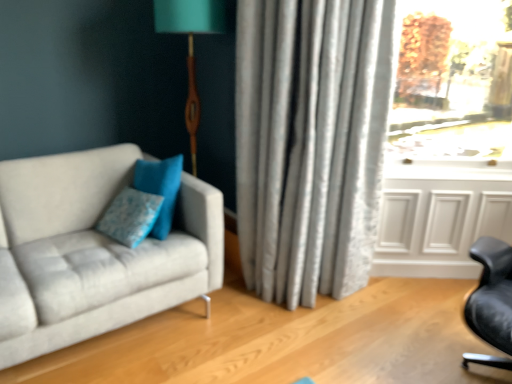
Question: Considering the relative sizes of transparent glass window at upper right and blue fabric pillow at center in the image provided, is transparent glass window at upper right thinner than blue fabric pillow at center?

Choices:
 (A) no
 (B) yes

Answer: (A)

Question: Does transparent glass window at upper right have a smaller size compared to blue fabric pillow at center?

Choices:
 (A) yes
 (B) no

Answer: (B)

Question: Would you say transparent glass window at upper right is outside blue fabric pillow at center?

Choices:
 (A) yes
 (B) no

Answer: (A)

Question: Can you confirm if transparent glass window at upper right is shorter than blue fabric pillow at center?

Choices:
 (A) no
 (B) yes

Answer: (A)

Question: Is transparent glass window at upper right far away from blue fabric pillow at center?

Choices:
 (A) yes
 (B) no

Answer: (A)

Question: From a real-world perspective, is blue fabric pillow at center positioned above or below silky gray curtain at center?

Choices:
 (A) above
 (B) below

Answer: (B)

Question: Based on their positions, is blue fabric pillow at center located to the left or right of silky gray curtain at center?

Choices:
 (A) right
 (B) left

Answer: (B)

Question: Is blue fabric pillow at center bigger or smaller than silky gray curtain at center?

Choices:
 (A) big
 (B) small

Answer: (B)

Question: Is blue fabric pillow at center wider or thinner than silky gray curtain at center?

Choices:
 (A) thin
 (B) wide

Answer: (A)

Question: Is white paneling at lower right in front of or behind suede gray couch at left in the image?

Choices:
 (A) behind
 (B) front

Answer: (A)

Question: Considering the positions of white paneling at lower right and suede gray couch at left in the image, is white paneling at lower right taller or shorter than suede gray couch at left?

Choices:
 (A) short
 (B) tall

Answer: (A)

Question: Visually, is white paneling at lower right positioned to the left or to the right of suede gray couch at left?

Choices:
 (A) right
 (B) left

Answer: (A)

Question: From a real-world perspective, is white paneling at lower right physically located above or below suede gray couch at left?

Choices:
 (A) below
 (B) above

Answer: (A)

Question: Looking at the image, does blue fabric pillow at center seem bigger or smaller compared to transparent glass window at upper right?

Choices:
 (A) big
 (B) small

Answer: (B)

Question: From a real-world perspective, is blue fabric pillow at center positioned above or below transparent glass window at upper right?

Choices:
 (A) below
 (B) above

Answer: (A)